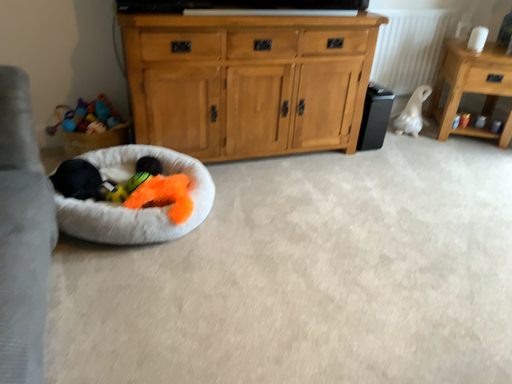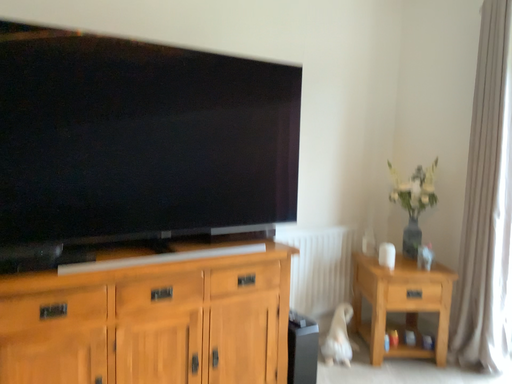
Question: Which way did the camera rotate in the video?

Choices:
 (A) rotated left
 (B) rotated right

Answer: (B)